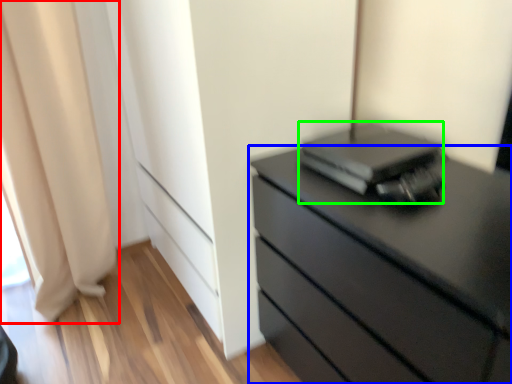
Question: Estimate the real-world distances between objects in this image. Which object is farther from curtain (highlighted by a red box), chest of drawers (highlighted by a blue box) or computer (highlighted by a green box)?

Choices:
 (A) chest of drawers
 (B) computer

Answer: (A)